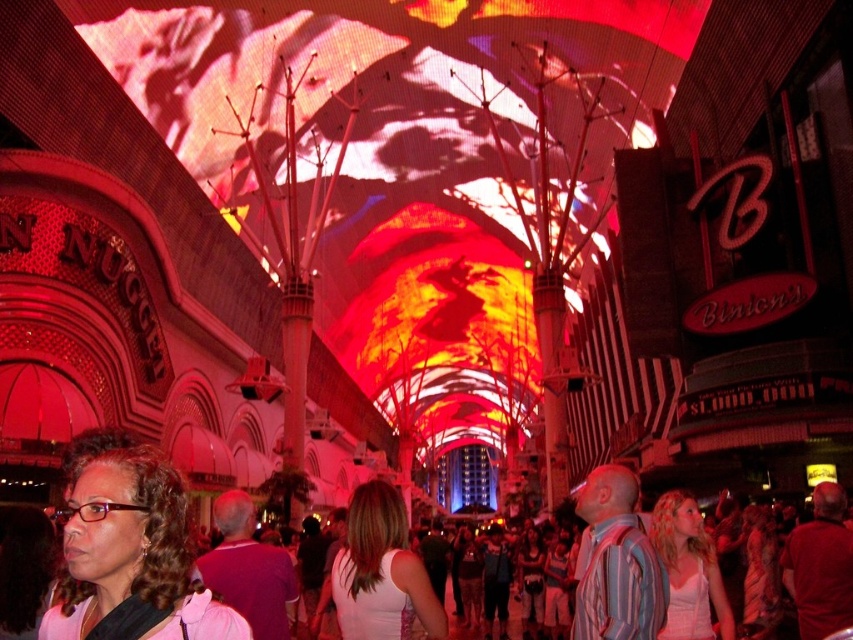
Question: Considering the real-world distances, which object is closest to the matte pink shirt at lower left?

Choices:
 (A) white fabric shirt at center
 (B) striped cotton shirt at center
 (C) matte white tank top at center

Answer: (A)

Question: Which point is farther to the camera?

Choices:
 (A) matte white tank top at center
 (B) red shirt at center
 (C) purple matte shirt at center
 (D) matte pink shirt at lower left

Answer: (A)

Question: Is the position of purple matte shirt at center more distant than that of red shirt at center?

Choices:
 (A) no
 (B) yes

Answer: (A)

Question: Is matte pink shirt at lower left below purple matte shirt at center?

Choices:
 (A) yes
 (B) no

Answer: (B)

Question: Does white fabric shirt at center have a larger size compared to matte white tank top at center?

Choices:
 (A) no
 (B) yes

Answer: (B)

Question: Among these points, which one is nearest to the camera?

Choices:
 (A) pos(189,609)
 (B) pos(595,534)
 (C) pos(369,502)

Answer: (A)